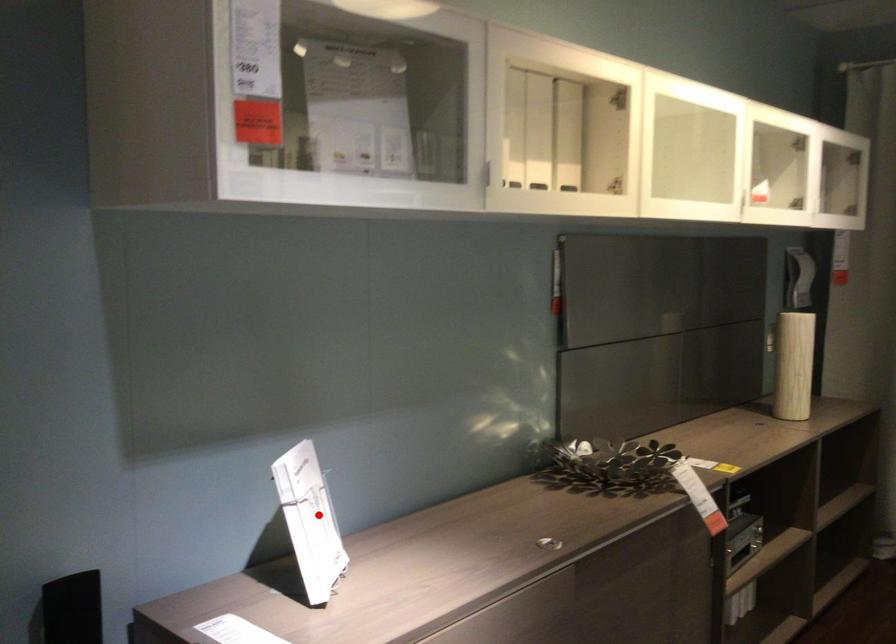
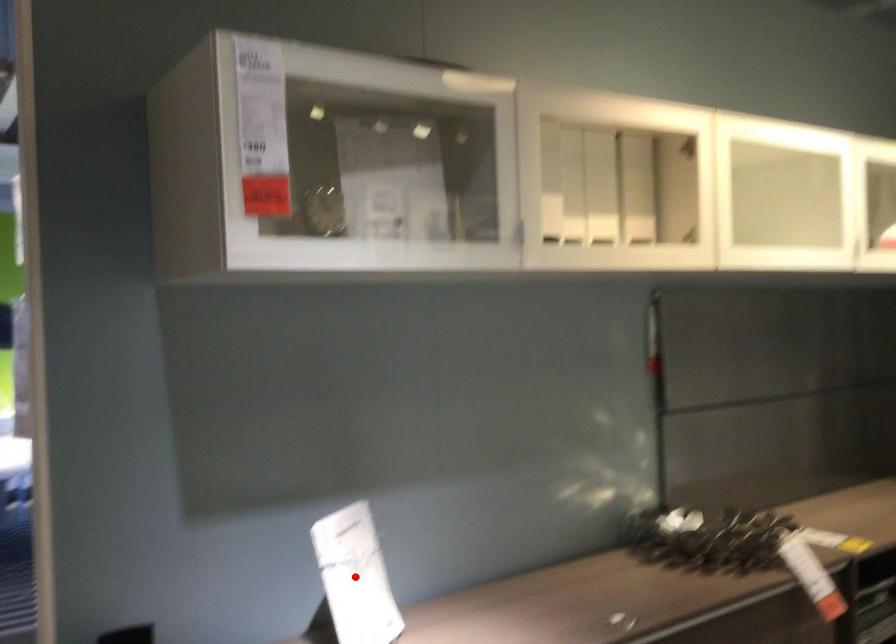
From the picture: I am providing you with two images of the same scene from different viewpoints. A red point is marked on the first image and another point is marked on the second image. Is the red point in image1 aligned with the point shown in image2?

Yes